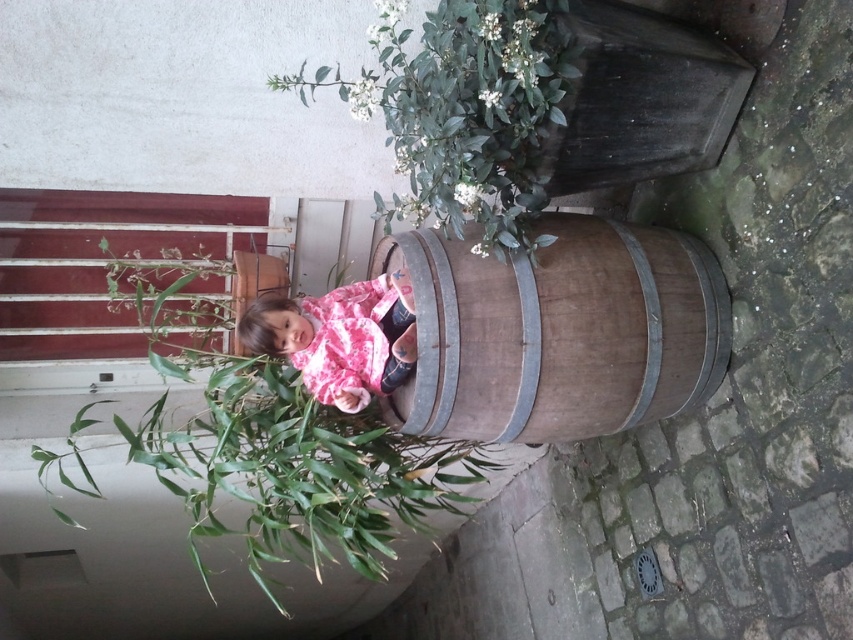
Question: Considering the relative positions of brown wooden barrel at center and pink cotton shirt at center in the image provided, where is brown wooden barrel at center located with respect to pink cotton shirt at center?

Choices:
 (A) right
 (B) left

Answer: (A)

Question: Which of the following is the farthest from the observer?

Choices:
 (A) (511, 173)
 (B) (283, 314)
 (C) (612, 412)

Answer: (B)

Question: Is the position of green leafy plant at center more distant than that of green leafy plant at upper center?

Choices:
 (A) yes
 (B) no

Answer: (A)

Question: Which of the following is the closest to the observer?

Choices:
 (A) (494, 419)
 (B) (428, 26)
 (C) (257, 340)

Answer: (B)

Question: Which point is farther from the camera taking this photo?

Choices:
 (A) (424, 104)
 (B) (416, 396)
 (C) (386, 324)
 (D) (320, 499)

Answer: (C)

Question: Is brown wooden barrel at center above green leafy plant at upper center?

Choices:
 (A) no
 (B) yes

Answer: (A)